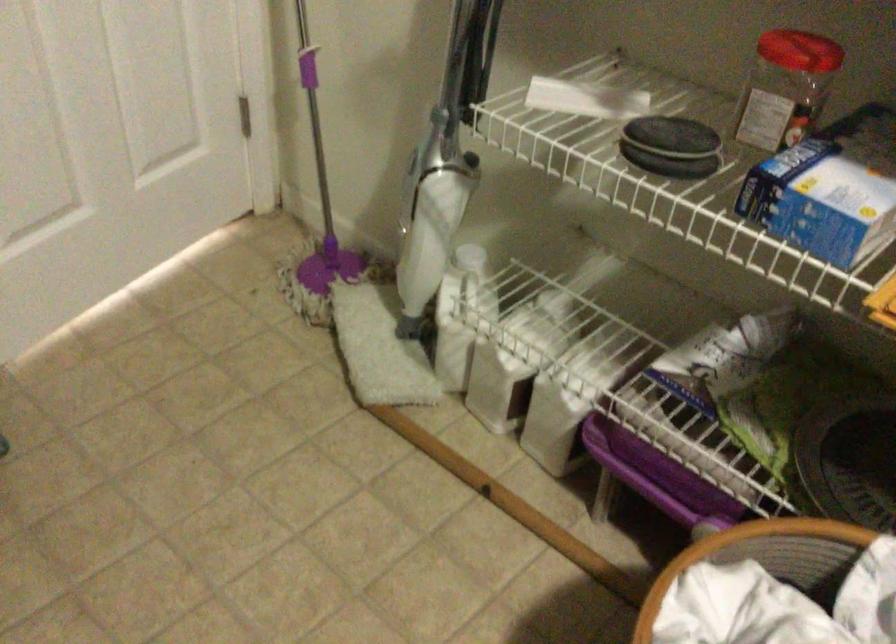
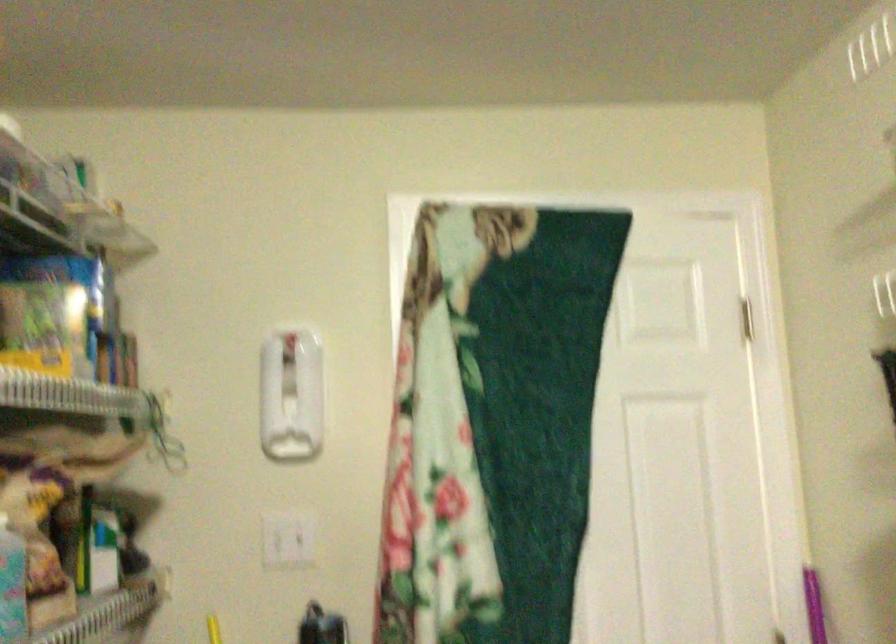
The first image is from the beginning of the video and the second image is from the end. How did the camera likely rotate when shooting the video?

The camera's rotation is toward left-up.